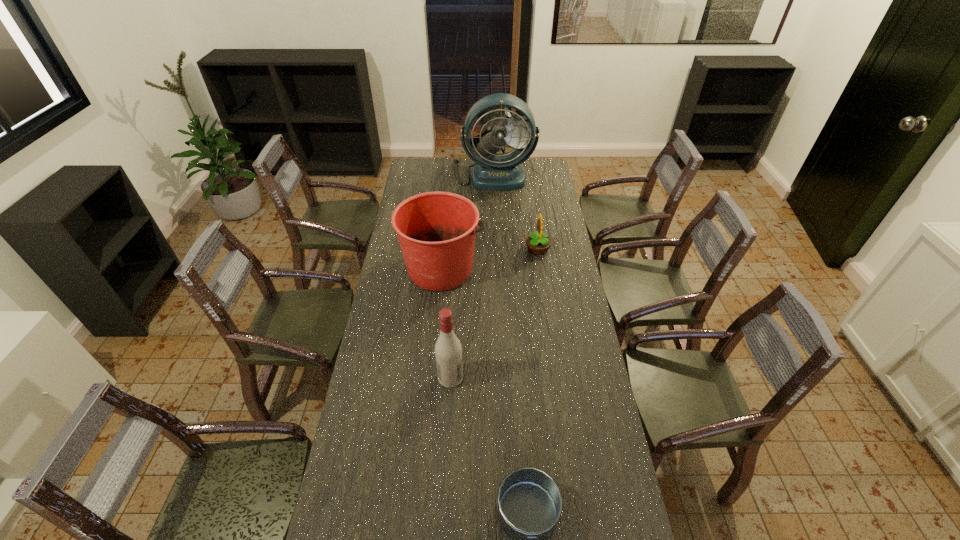
You are a GUI agent. You are given a task and a screenshot of the screen. Output one action in this format:
    pyautogui.click(x=<x>, y=<y>)
    Task: Click on the blank region between the fan and the second shortest object
    The width and height of the screenshot is (960, 540).
    Given the screenshot: What is the action you would take?
    pyautogui.click(x=516, y=212)

Locate an element on the screen. blank region between the sunflower and the bucket is located at coordinates (490, 259).

Identify the location of unoccupied area between the alcohol and the fan. (472, 276).

Locate an element on the screen. vacant area that lies between the second shortest object and the second nearest object is located at coordinates (494, 313).

I want to click on vacant area that lies between the alcohol and the farthest object, so coord(472,276).

Identify which object is the second nearest to the saucepan. Please provide its 2D coordinates. Your answer should be formatted as a tuple, i.e. [(x, y)], where the tuple contains the x and y coordinates of a point satisfying the conditions above.

[(436, 231)]

The width and height of the screenshot is (960, 540). Find the location of `object that is the second closest to the bucket`. object that is the second closest to the bucket is located at coordinates (x=448, y=351).

The height and width of the screenshot is (540, 960). Find the location of `blank area in the image that satisfies the following two spatial constraints: 1. in front of the farthest object to blow air; 2. on the label of the fourth farthest object`. blank area in the image that satisfies the following two spatial constraints: 1. in front of the farthest object to blow air; 2. on the label of the fourth farthest object is located at coordinates (501, 377).

Locate an element on the screen. This screenshot has width=960, height=540. free point that satisfies the following two spatial constraints: 1. in front of the farthest object to blow air; 2. on the label of the alcohol is located at coordinates (501, 377).